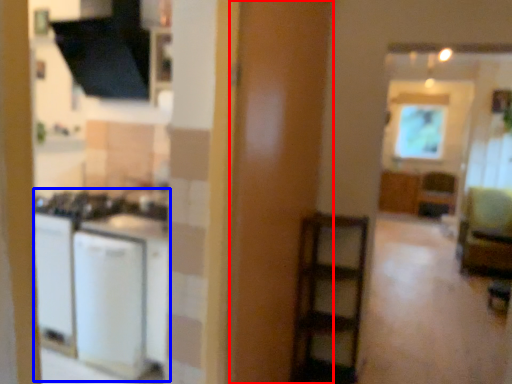
Question: Which of the following is the closest to the observer, screen door (highlighted by a red box) or appliance (highlighted by a blue box)?

Choices:
 (A) screen door
 (B) appliance

Answer: (A)